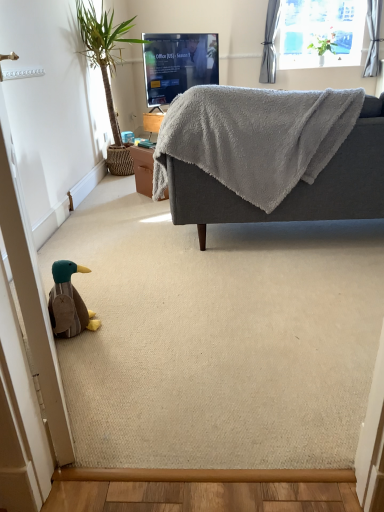
You are a GUI agent. You are given a task and a screenshot of the screen. Output one action in this format:
    pyautogui.click(x=<x>, y=<y>)
    Task: Click on the unoccupied region to the right of brown plush duck at lower left
    The image size is (384, 512).
    Given the screenshot: What is the action you would take?
    pyautogui.click(x=122, y=321)